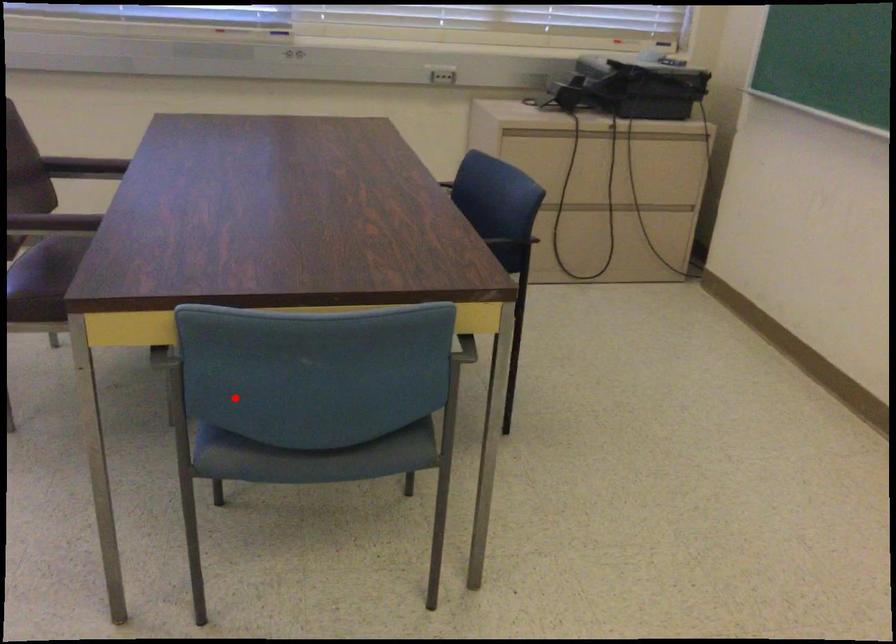
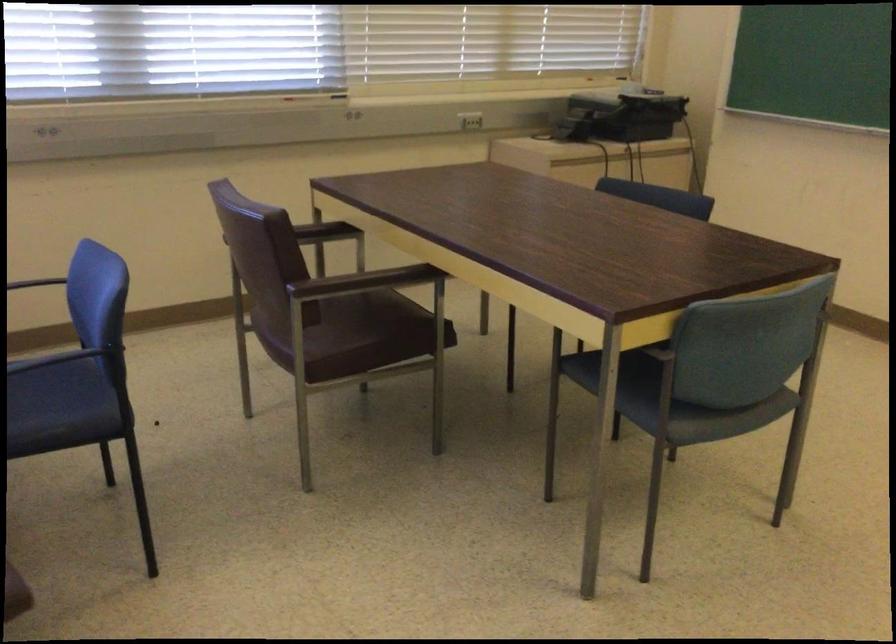
Question: I am providing you with two images of the same scene from different viewpoints. A red point is shown in image1. For the corresponding object point in image2, is it positioned nearer or farther from the camera?

Choices:
 (A) Nearer
 (B) Farther

Answer: (B)